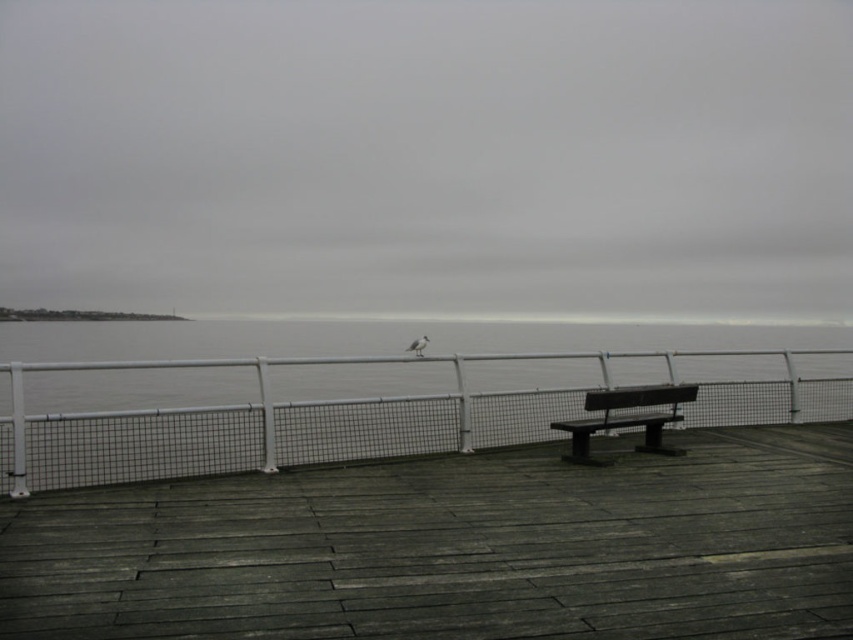
Question: Is white metal fence at center below dark brown wooden bench at center?

Choices:
 (A) no
 (B) yes

Answer: (A)

Question: Which of the following is the farthest from the observer?

Choices:
 (A) gray cloudy sky at upper center
 (B) white metal fence at center

Answer: (A)

Question: Does weathered wood deck at center appear on the left side of white metal fence at center?

Choices:
 (A) no
 (B) yes

Answer: (B)

Question: Estimate the real-world distances between objects in this image. Which object is farther from the dark brown wooden bench at center?

Choices:
 (A) gray cloudy sky at upper center
 (B) weathered wood deck at center
 (C) white metal fence at center

Answer: (A)

Question: Among these objects, which one is nearest to the camera?

Choices:
 (A) dark brown wooden bench at center
 (B) weathered wood deck at center

Answer: (B)

Question: Can you confirm if weathered wood deck at center is wider than dark brown wooden bench at center?

Choices:
 (A) yes
 (B) no

Answer: (A)